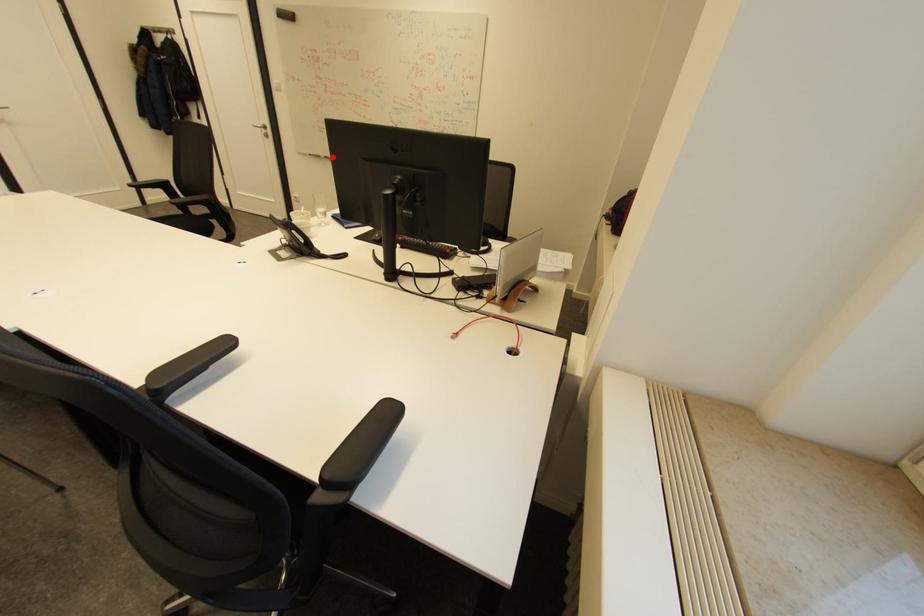
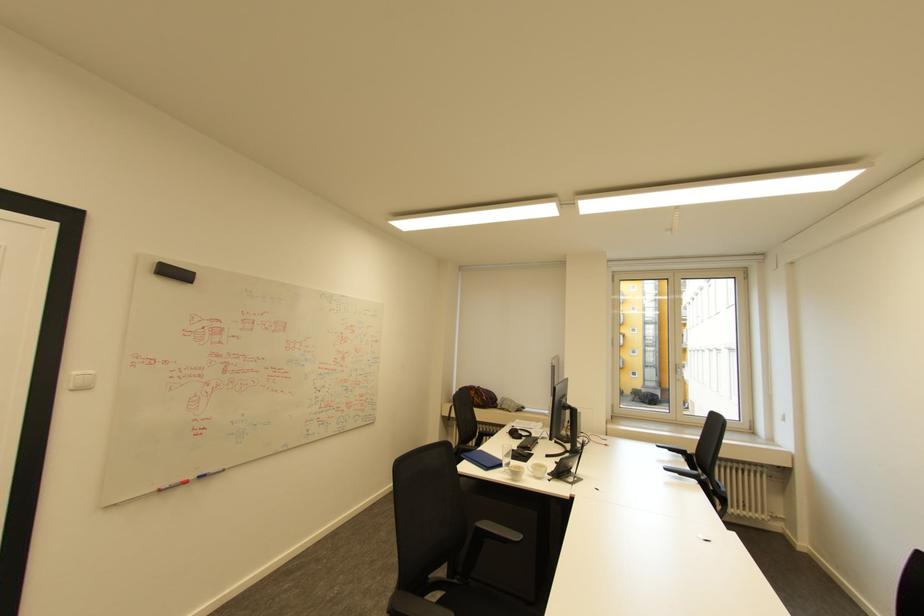
The point at the highlighted location is marked in the first image. Where is the corresponding point in the second image?

(207, 477)